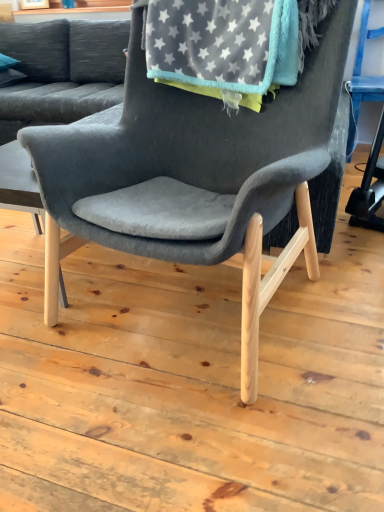
Identify the location of light wood table at center. (19, 183).

Where is `velvet gray chair at center`? The image size is (384, 512). velvet gray chair at center is located at coordinates (195, 175).

Image resolution: width=384 pixels, height=512 pixels. Describe the element at coordinates (223, 47) in the screenshot. I see `gray fleece blanket at upper center` at that location.

The height and width of the screenshot is (512, 384). Find the location of `velvet gray couch at upper left`. velvet gray couch at upper left is located at coordinates (62, 72).

Considering the points (21, 153) and (82, 28), which point is in front, point (21, 153) or point (82, 28)?

Point (21, 153)

Is light wood table at center next to velvet gray couch at upper left?

No, light wood table at center is not with velvet gray couch at upper left.

From the image's perspective, which one is positioned lower, light wood table at center or velvet gray couch at upper left?

light wood table at center, from the image's perspective.

Measure the distance from light wood table at center to velvet gray couch at upper left.

They are 1.14 meters apart.

Does velvet gray couch at upper left have a lesser width compared to light wood table at center?

Incorrect, the width of velvet gray couch at upper left is not less than that of light wood table at center.

Are velvet gray couch at upper left and light wood table at center far apart?

Absolutely, velvet gray couch at upper left is distant from light wood table at center.

Is velvet gray couch at upper left looking in the opposite direction of light wood table at center?

velvet gray couch at upper left does not have its back to light wood table at center.

Would you say light wood table at center is part of velvet gray chair at center's contents?

No, light wood table at center is located outside of velvet gray chair at center.

Considering their positions, is velvet gray chair at center located in front of or behind light wood table at center?

In the image, velvet gray chair at center appears in front of light wood table at center.

Which object is thinner, velvet gray chair at center or light wood table at center?

Thinner between the two is light wood table at center.

Is gray fleece blanket at upper center wider or thinner than velvet gray couch at upper left?

Considering their sizes, gray fleece blanket at upper center looks slimmer than velvet gray couch at upper left.

This screenshot has width=384, height=512. Identify the location of studio couch above the gray fleece blanket at upper center (from the image's perspective). (62, 72).

How different are the orientations of gray fleece blanket at upper center and velvet gray couch at upper left in degrees?

8.64 degrees separate the facing orientations of gray fleece blanket at upper center and velvet gray couch at upper left.

Do you think gray fleece blanket at upper center is within velvet gray couch at upper left, or outside of it?

gray fleece blanket at upper center is located beyond the bounds of velvet gray couch at upper left.

Based on their sizes in the image, would you say light wood table at center is bigger or smaller than velvet gray chair at center?

In the image, light wood table at center appears to be smaller than velvet gray chair at center.

Between light wood table at center and velvet gray chair at center, which one appears on the left side from the viewer's perspective?

light wood table at center is more to the left.

Considering the relative sizes of light wood table at center and velvet gray chair at center in the image provided, is light wood table at center shorter than velvet gray chair at center?

Yes.

From a real-world perspective, is light wood table at center positioned above or below velvet gray chair at center?

light wood table at center is below velvet gray chair at center.

Which point is more forward, (158, 88) or (159, 34)?

The point (159, 34) is closer to the camera.

Between velvet gray chair at center and gray fleece blanket at upper center, which one has smaller width?

gray fleece blanket at upper center.

Based on their sizes in the image, would you say velvet gray chair at center is bigger or smaller than gray fleece blanket at upper center?

Considering their sizes, velvet gray chair at center takes up more space than gray fleece blanket at upper center.

Identify the location of chair below the gray fleece blanket at upper center (from a real-world perspective). The image size is (384, 512). (195, 175).

Between velvet gray chair at center and velvet gray couch at upper left, which one has smaller width?

velvet gray couch at upper left.

Which is farther from the camera, (263,287) or (26,88)?

Positioned behind is point (26,88).

What's the angular difference between velvet gray chair at center and velvet gray couch at upper left's facing directions?

There is a 8.64-degree angle between the facing directions of velvet gray chair at center and velvet gray couch at upper left.

This screenshot has width=384, height=512. I want to click on chair below the velvet gray couch at upper left (from the image's perspective), so click(x=195, y=175).

Find the location of `table located in front of the velvet gray couch at upper left`. table located in front of the velvet gray couch at upper left is located at coordinates (19, 183).

This screenshot has width=384, height=512. Find the location of `studio couch on the left side of light wood table at center`. studio couch on the left side of light wood table at center is located at coordinates (62, 72).

Considering their positions, is velvet gray couch at upper left positioned further to velvet gray chair at center than gray fleece blanket at upper center?

velvet gray couch at upper left.

Estimate the real-world distances between objects in this image. Which object is further from gray fleece blanket at upper center, light wood table at center or velvet gray chair at center?

Among the two, light wood table at center is located further to gray fleece blanket at upper center.

Which object lies further to the anchor point gray fleece blanket at upper center, velvet gray chair at center or velvet gray couch at upper left?

The object further to gray fleece blanket at upper center is velvet gray couch at upper left.

From the image, which object appears to be farther from light wood table at center, gray fleece blanket at upper center or velvet gray chair at center?

gray fleece blanket at upper center is positioned further to the anchor light wood table at center.

Considering their positions, is velvet gray couch at upper left positioned closer to velvet gray chair at center than light wood table at center?

light wood table at center is positioned closer to the anchor velvet gray chair at center.

From the image, which object appears to be farther from velvet gray couch at upper left, gray fleece blanket at upper center or light wood table at center?

Among the two, gray fleece blanket at upper center is located further to velvet gray couch at upper left.

Which object lies further to the anchor point velvet gray chair at center, gray fleece blanket at upper center or light wood table at center?

light wood table at center is positioned further to the anchor velvet gray chair at center.

When comparing their distances from gray fleece blanket at upper center, does velvet gray couch at upper left or light wood table at center seem further?

velvet gray couch at upper left is positioned further to the anchor gray fleece blanket at upper center.

Locate an element on the screen. The image size is (384, 512). table positioned between gray fleece blanket at upper center and velvet gray couch at upper left from near to far is located at coordinates (19, 183).

Identify the location of blanket between velvet gray chair at center and velvet gray couch at upper left along the z-axis. The image size is (384, 512). (223, 47).

The height and width of the screenshot is (512, 384). What are the coordinates of `table between velvet gray chair at center and velvet gray couch at upper left along the z-axis` in the screenshot? It's located at (19, 183).

Find the location of a particular element. This screenshot has height=512, width=384. chair between light wood table at center and gray fleece blanket at upper center in the horizontal direction is located at coordinates (195, 175).